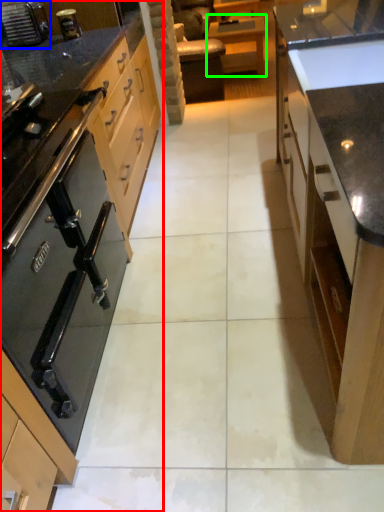
Question: Considering the real-world distances, which object is farthest from cabinetry (highlighted by a red box)? home appliance (highlighted by a blue box) or table (highlighted by a green box)?

Choices:
 (A) home appliance
 (B) table

Answer: (B)